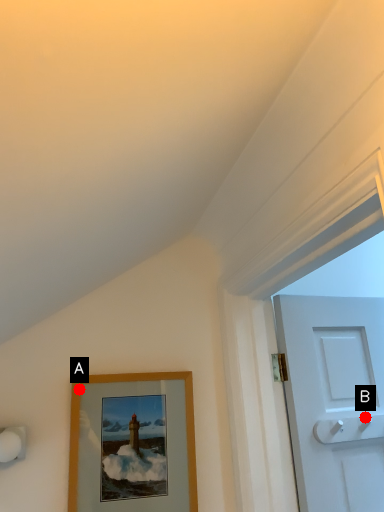
Question: Two points are circled on the image, labeled by A and B beside each circle. Which point is farther to the camera?

Choices:
 (A) A is further
 (B) B is further

Answer: (B)